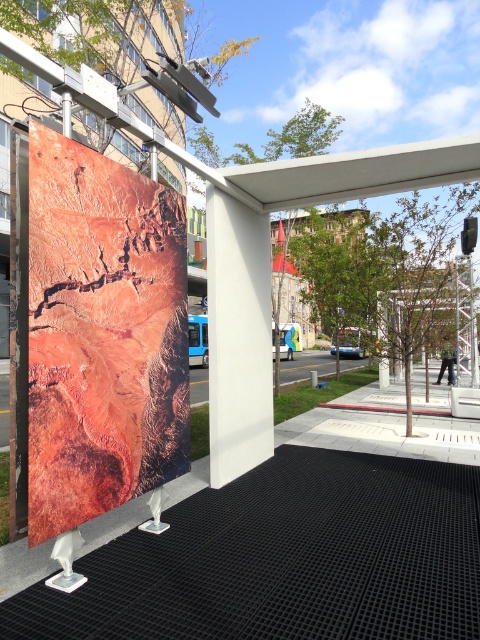
You are a delivery person trying to place a new rectangular package that is 1.5 meters wide. You have to choose between placing it on the rustic canvas poster at center or the white matte pillar at center. Based on their widths, which object can fit the package?

The rustic canvas poster at center has a larger width than the white matte pillar at center, so the package can fit on the rustic canvas poster at center.

You are standing in front of the artwork and want to take a photo of both the rustic canvas poster at center and the white matte pillar at center. Which object should you position to your right side to ensure both are in the frame?

You should position the white matte pillar at center to your right side because the rustic canvas poster at center is to the left of it, so placing the pillar on your right will keep both in the frame.